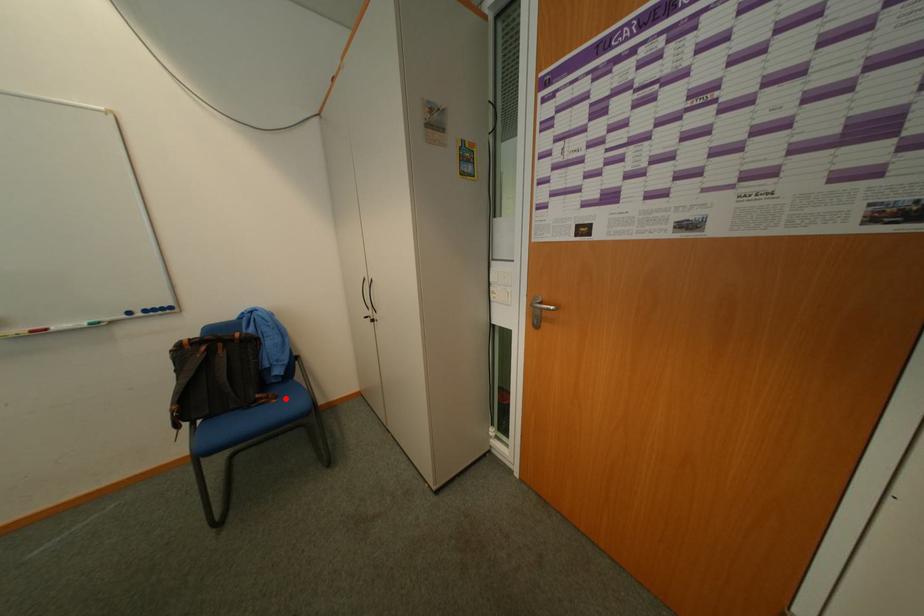
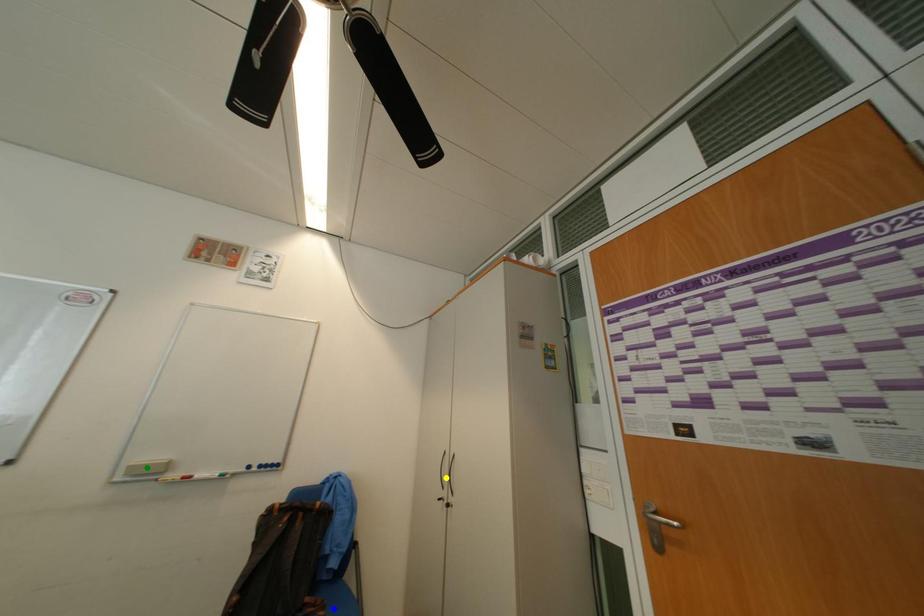
Question: I am providing you with two images of the same scene from different viewpoints. A red point is marked on the first image. You are given multiple points on the second image. Which point in image 2 is actually the same real-world point as the red point in image 1?

Choices:
 (A) green point
 (B) yellow point
 (C) blue point

Answer: (C)